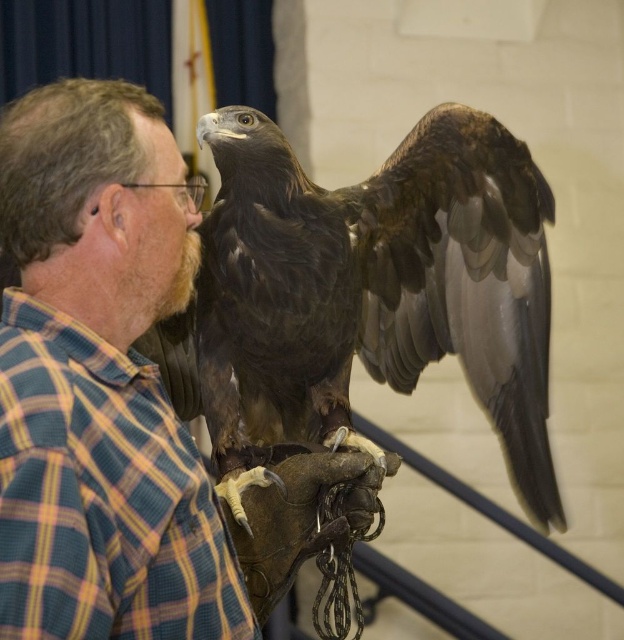
Is the position of brown feathered falcon at center less distant than that of plaid cotton shirt at upper left?

No, it is behind plaid cotton shirt at upper left.

Who is more distant from viewer, (243,172) or (205,536)?

The point (243,172) is behind.

You are a GUI agent. You are given a task and a screenshot of the screen. Output one action in this format:
    pyautogui.click(x=<x>, y=<y>)
    Task: Click on the brown feathered falcon at center
    This screenshot has height=640, width=624.
    Given the screenshot: What is the action you would take?
    pos(373,288)